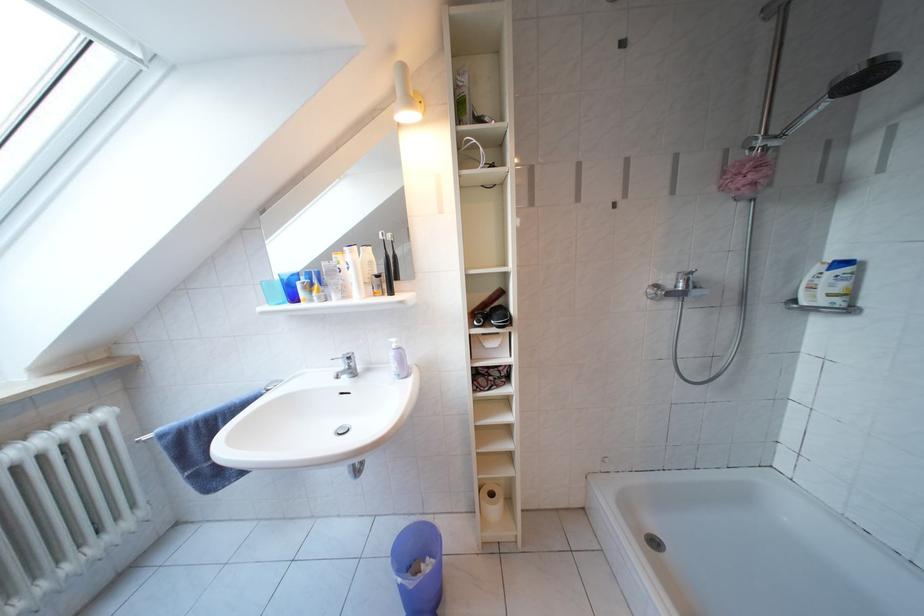
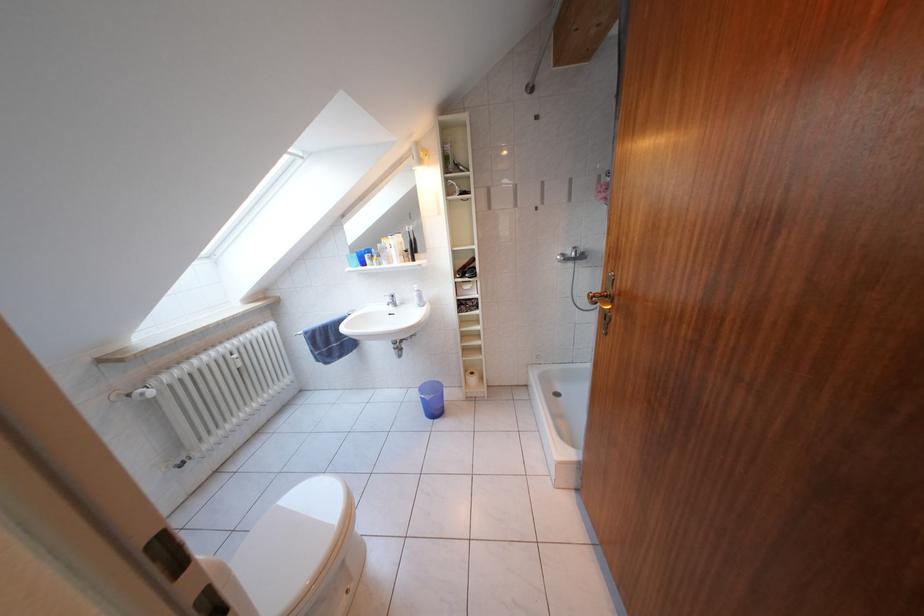
Question: Which direction would the cameraman need to move to produce the second image? Reply with the corresponding letter.

Choices:
 (A) Left
 (B) Right
 (C) Forward
 (D) Backward

Answer: (D)